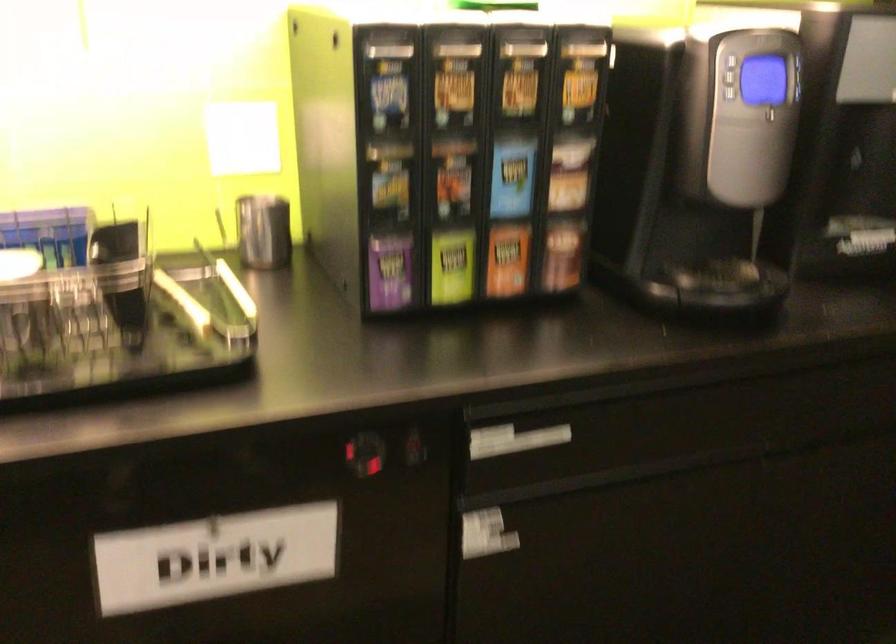
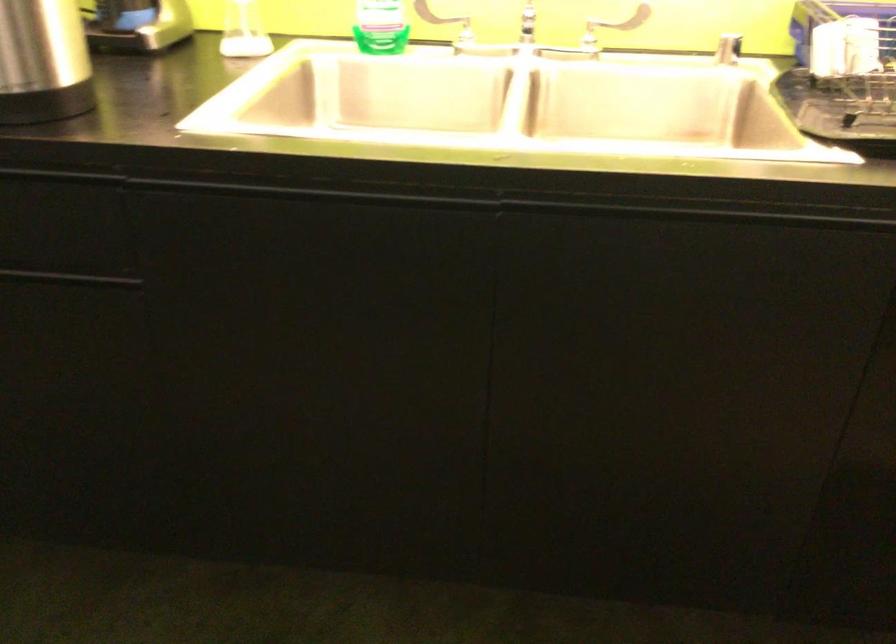
In a continuous first-person perspective shot, in which direction is the camera moving?

The cameraman walked toward left, backward.